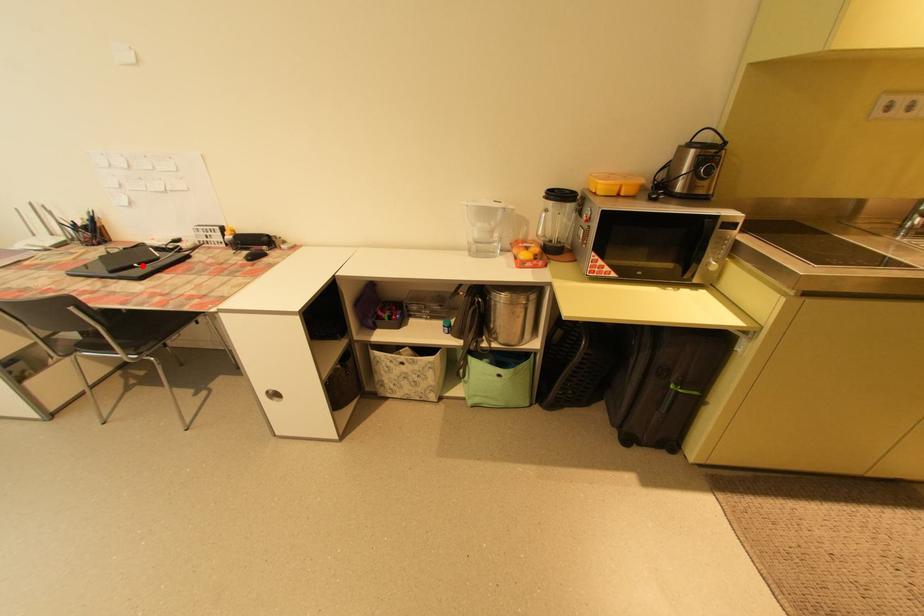
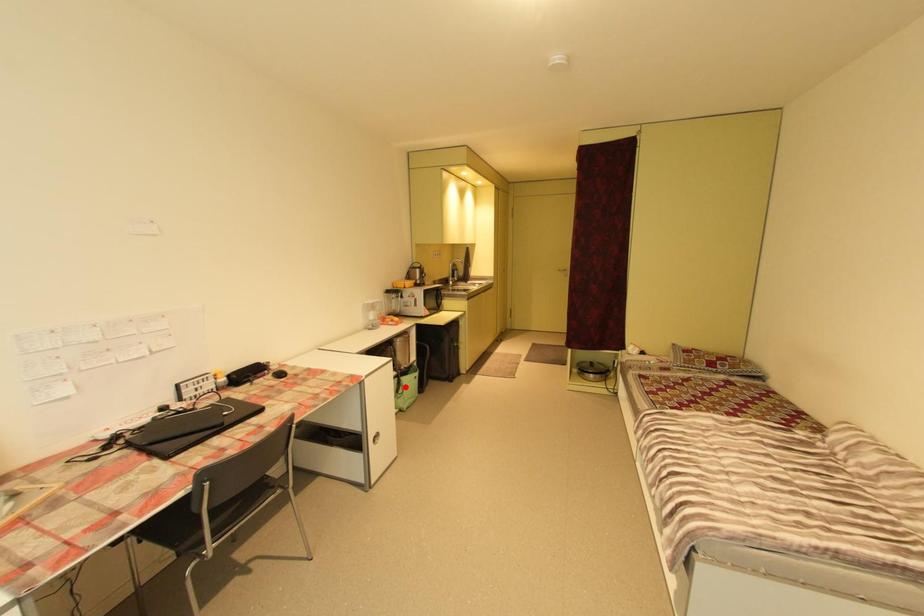
I am providing you with two images of the same scene from different viewpoints. A red point is marked on the first image and another point is marked on the second image. Do the highlighted points in image1 and image2 indicate the same real-world spot?

No